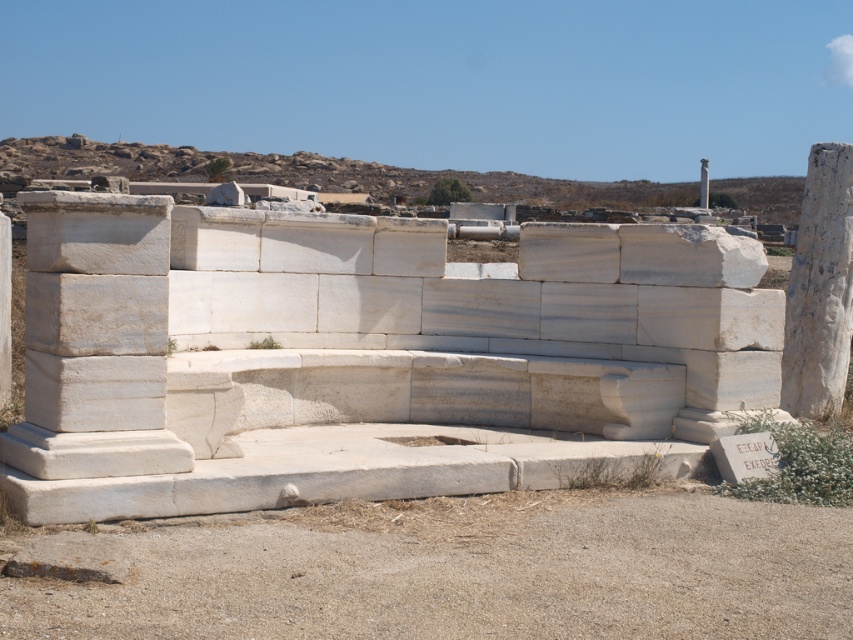
Can you confirm if white marble pillar at left is positioned below white marble pillar at center?

Indeed, white marble pillar at left is positioned under white marble pillar at center.

Can you confirm if white marble pillar at left is positioned to the left of white marble pillar at center?

Indeed, white marble pillar at left is positioned on the left side of white marble pillar at center.

Which is behind, point (3, 336) or point (700, 172)?

The point (700, 172) is behind.

Locate an element on the screen. white marble pillar at left is located at coordinates (4, 308).

Is point (817, 296) closer to viewer compared to point (4, 356)?

No, (817, 296) is behind (4, 356).

Can you confirm if white marble pillar at right is bigger than white marble pillar at left?

Yes, white marble pillar at right is bigger than white marble pillar at left.

Identify the location of white marble pillar at right. This screenshot has width=853, height=640. (820, 288).

The image size is (853, 640). I want to click on white marble pillar at right, so click(820, 288).

Which is in front, point (143, 349) or point (706, 160)?

Point (143, 349) is more forward.

Can you confirm if white marble bench at center is thinner than white marble pillar at center?

Yes.

The width and height of the screenshot is (853, 640). In order to click on white marble bench at center in this screenshot , I will do click(x=363, y=353).

Find the location of a particular element. white marble bench at center is located at coordinates (363, 353).